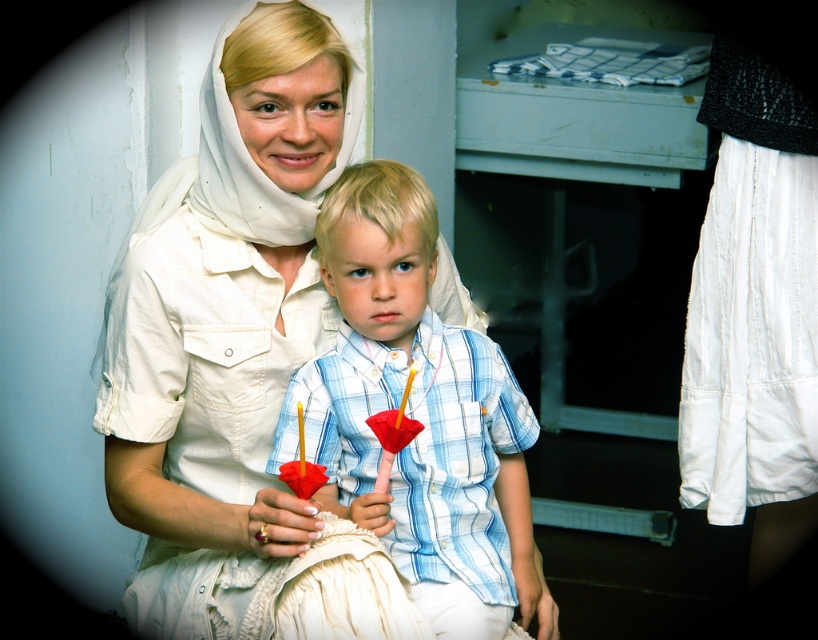
You are a photographer trying to capture a closeup shot of the white matte dress at center and the light blue plaid shirt at center. Which one is positioned higher in the image?

The white matte dress at center is located above the light blue plaid shirt at center, so it is positioned higher in the image.